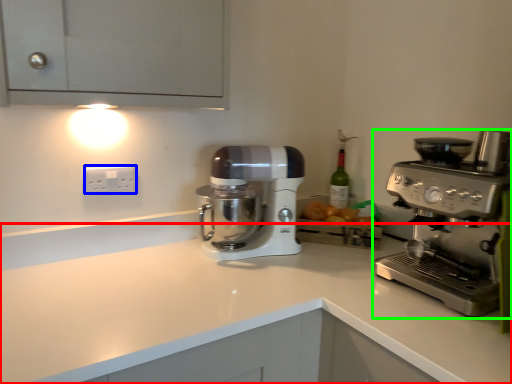
Question: Based on their relative distances, which object is farther from counter top (highlighted by a red box)? Choose from electric outlet (highlighted by a blue box) and coffee maker (highlighted by a green box).

Choices:
 (A) electric outlet
 (B) coffee maker

Answer: (A)